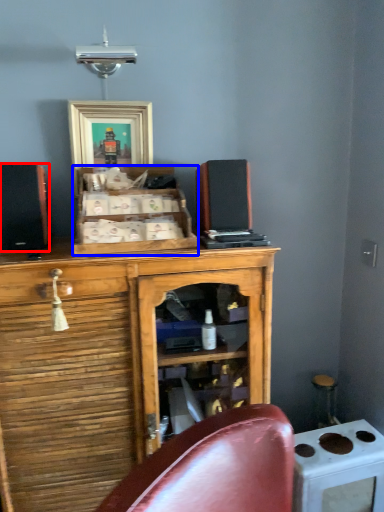
Question: Which object appears farthest to the camera in this image, speaker (highlighted by a red box) or cabinetry (highlighted by a blue box)?

Choices:
 (A) speaker
 (B) cabinetry

Answer: (A)